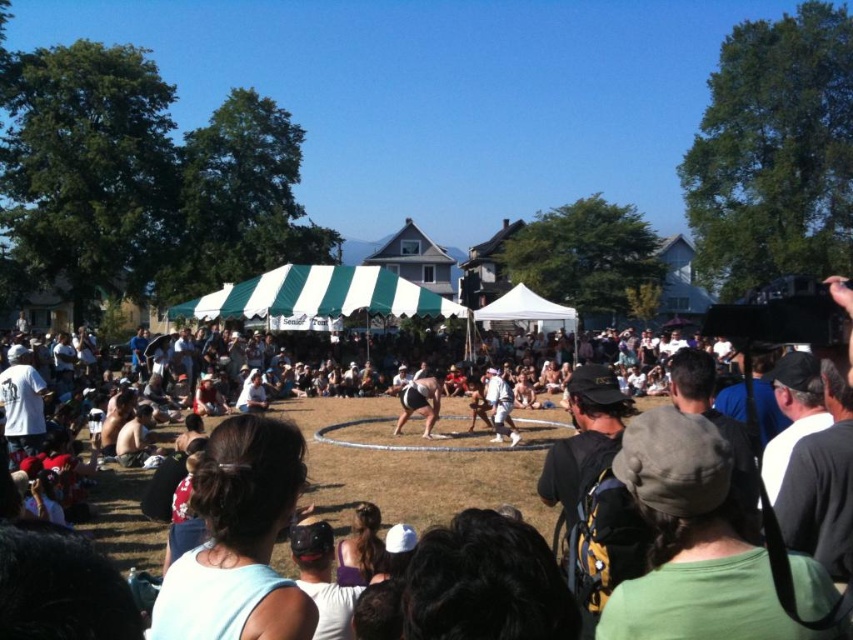
You are a photographer positioned at the origin point of the image coordinate system. You need to capture a photo of the dark gray fabric crowd at center. What are the coordinates where you should aim your camera?

The coordinates to aim your camera are at point (416, 461) to capture the dark gray fabric crowd at center.

You are a photographer at the event and want to capture both the dark gray fabric crowd at center and the black fabric sumo wrestler at center in a single photo. Given that your camera can only focus on objects larger than a certain size, which of the two will be in focus?

The dark gray fabric crowd at center is bigger than the black fabric sumo wrestler at center, so the dark gray fabric crowd at center will be in focus.